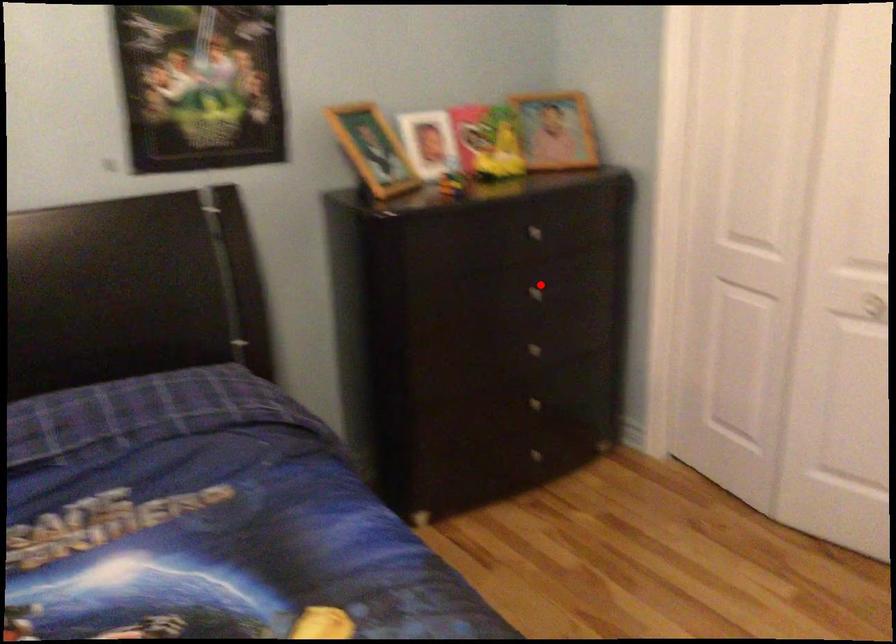
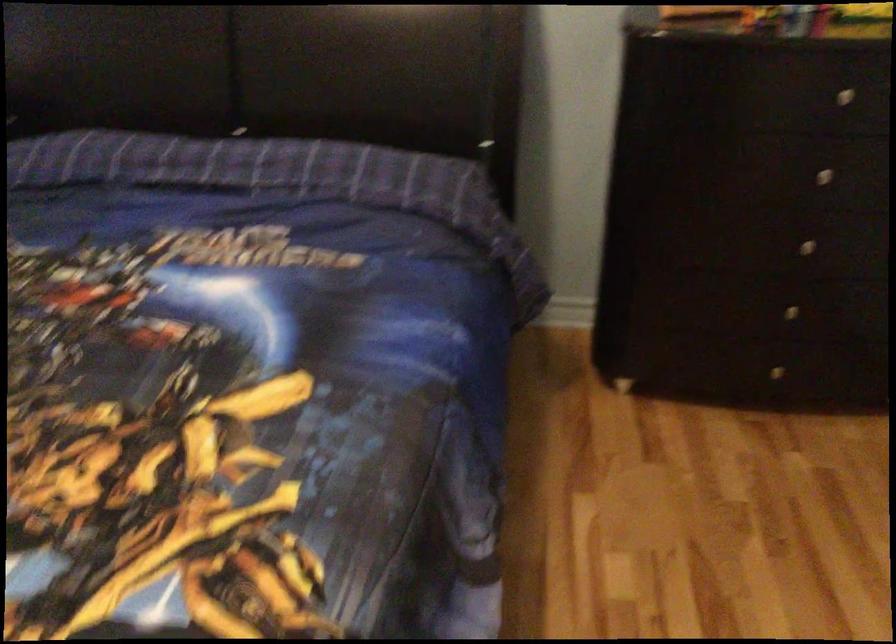
Question: I am providing you with two images of the same scene from different viewpoints. In image1, a red point is highlighted. Considering the same 3D point in image2, which of the following is correct?

Choices:
 (A) It is closer
 (B) It is farther

Answer: (A)